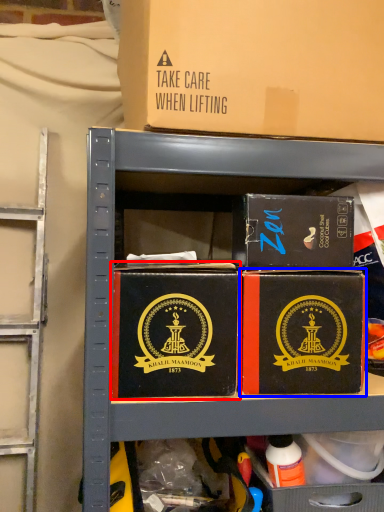
Question: Which point is closer to the camera, box (highlighted by a red box) or box (highlighted by a blue box)?

Choices:
 (A) box
 (B) box

Answer: (A)